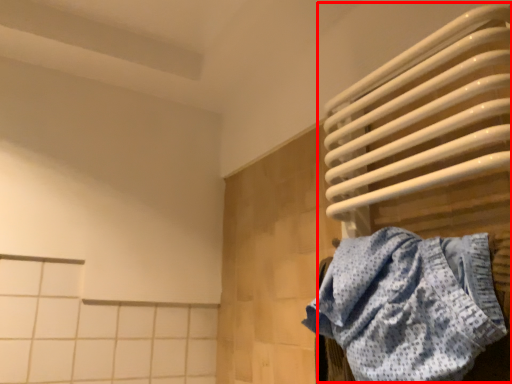
Question: From the image's perspective, considering the relative positions of water heater (annotated by the red box) and towel in the image provided, where is water heater (annotated by the red box) located with respect to the staircase?

Choices:
 (A) above
 (B) below

Answer: (A)